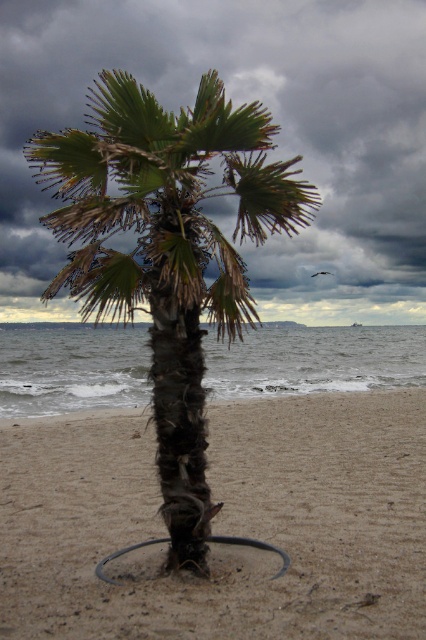
Question: Which of the following is the farthest from the observer?

Choices:
 (A) (0, 180)
 (B) (227, 422)

Answer: (A)

Question: Is dark gray cloud at upper center further to camera compared to green rough bark palm tree at center?

Choices:
 (A) yes
 (B) no

Answer: (A)

Question: Is brown sandy beach at center bigger than dark gray cloud at upper center?

Choices:
 (A) yes
 (B) no

Answer: (B)

Question: Is dark gray cloud at upper center positioned in front of green rough bark palm tree at center?

Choices:
 (A) no
 (B) yes

Answer: (A)

Question: Which object appears closest to the camera in this image?

Choices:
 (A) brown sandy beach at center
 (B) dark gray cloud at upper center

Answer: (A)

Question: Which of the following is the closest to the observer?

Choices:
 (A) (321, 284)
 (B) (5, 506)

Answer: (B)